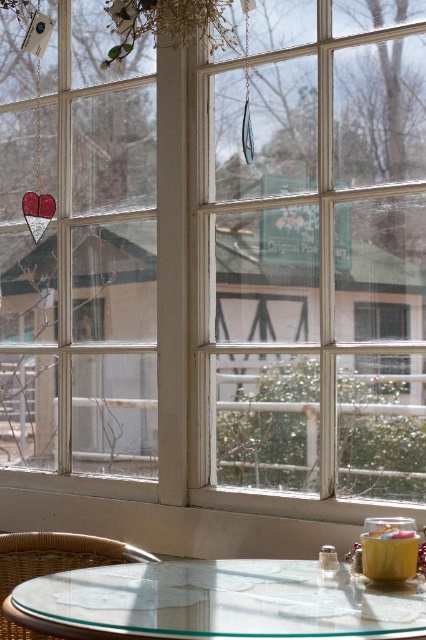
Can you confirm if transparent glass table at lower center is positioned to the left of rattan chair at lower left?

No, transparent glass table at lower center is not to the left of rattan chair at lower left.

Between transparent glass table at lower center and rattan chair at lower left, which one has more height?

rattan chair at lower left

Who is more forward, (189, 609) or (5, 572)?

Point (189, 609) is in front.

At what (x,y) coordinates should I click in order to perform the action: click on transparent glass table at lower center. Please return your answer as a coordinate pair (x, y). Looking at the image, I should click on (221, 600).